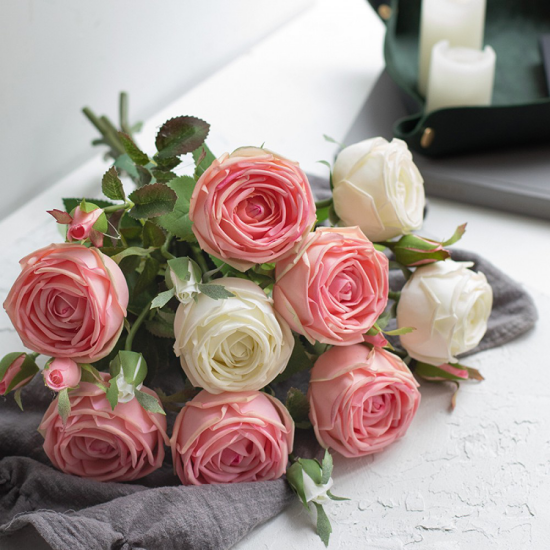
This screenshot has height=550, width=550. Find the location of `candles`. candles is located at coordinates (455, 84), (458, 16).